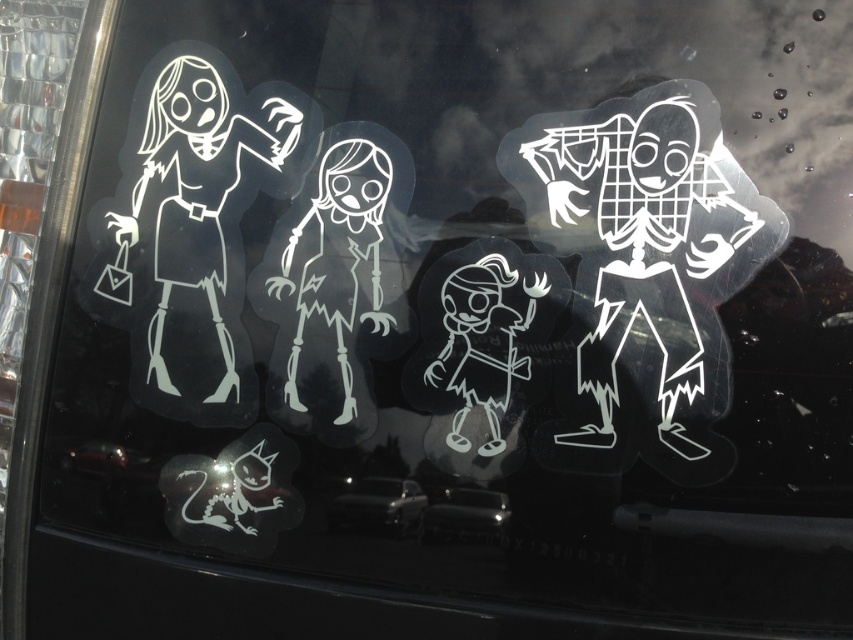
Question: Is transparent plastic figure at right thinner than black glossy car at center?

Choices:
 (A) no
 (B) yes

Answer: (A)

Question: Which object appears farthest from the camera in this image?

Choices:
 (A) white glossy skeleton at center
 (B) white matte skeleton at center
 (C) transparent plastic car at lower center

Answer: (A)

Question: Which of these objects is positioned closest to the white glossy skeleton at center?

Choices:
 (A) white glossy sticker at left
 (B) transparent plastic car at lower center

Answer: (A)

Question: Which object is positioned farthest from the black glossy car at center?

Choices:
 (A) transparent plastic figure at right
 (B) transparent plastic car at lower center
 (C) white matte skeleton at center

Answer: (A)

Question: Does white glossy sticker at left appear on the right side of transparent plastic car at lower center?

Choices:
 (A) yes
 (B) no

Answer: (B)

Question: Does transparent plastic figure at right appear on the left side of white glossy sticker at left?

Choices:
 (A) no
 (B) yes

Answer: (A)